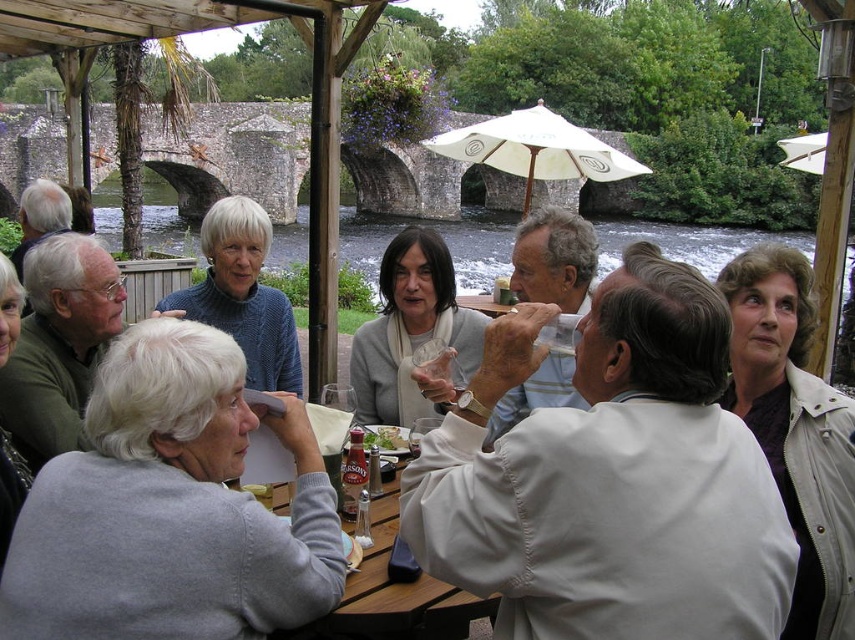
Question: Is light beige jacket at center in front of light beige jacket at upper right?

Choices:
 (A) no
 (B) yes

Answer: (B)

Question: Which point is closer to the camera?

Choices:
 (A) wooden table at center
 (B) matte gray sweater at center

Answer: (A)

Question: Can you confirm if gray cotton sweater at upper left is wider than metallic silver can at table center?

Choices:
 (A) yes
 (B) no

Answer: (A)

Question: Which point is farther to the camera?

Choices:
 (A) (157, 524)
 (B) (811, 580)
 (C) (481, 246)
 (D) (217, 326)

Answer: (C)

Question: Can you confirm if light beige jacket at center is positioned below gray cotton sweater at upper left?

Choices:
 (A) yes
 (B) no

Answer: (B)

Question: Estimate the real-world distances between objects in this image. Which object is farther from the matte gray sweater at center?

Choices:
 (A) white fabric umbrella at center
 (B) light beige jacket at center
 (C) knitted sweater at upper center

Answer: (A)